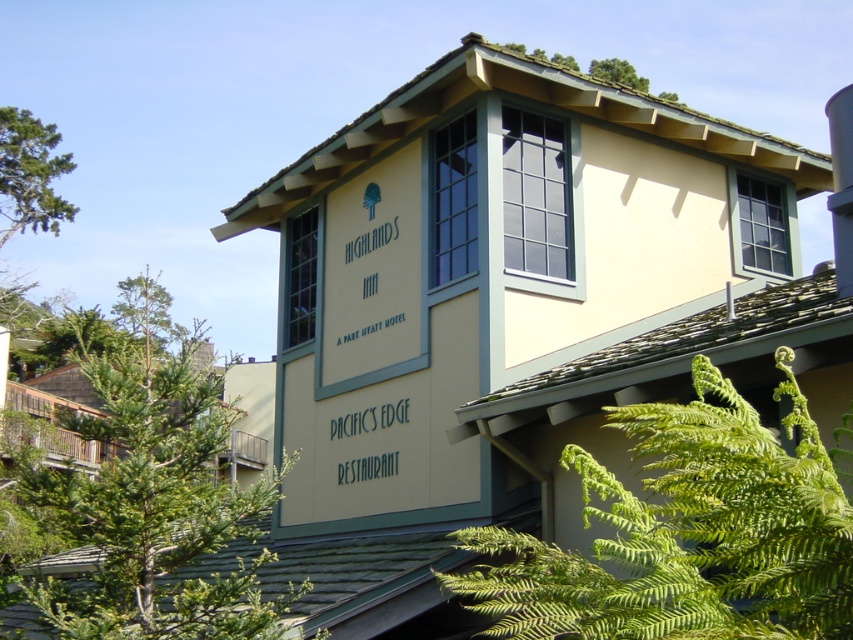
Looking at this image, you are standing in front of the Highlands Inn and want to place a decorative pot between the green leafy fern at lower right and the green leafy tree at upper center. Which object should you place the pot closer to if you want the pot to be closer to the narrower plant?

The green leafy fern at lower right has a lesser width compared to the green leafy tree at upper center, so you should place the pot closer to the green leafy fern at lower right to be nearer to the narrower plant.

You are standing at the entrance of the Highlands Inn and want to take a photo of the green leafy tree at center. Where should you position yourself to capture the tree in the frame?

The green leafy tree at center is located at point 0.772 on the x axis and 0.179 on the y axis, so you should position yourself in the lower right area to capture the tree in the frame.

In the scene shown: You are standing in front of the Highlands Inn building and want to locate the green leafy fern at lower right. Based on the 2D coordinates provided, which direction should you look to find it?

The green leafy fern at lower right is located at point 0.833 on the x axis and 0.805 on the y axis, so you should look to the lower right direction to find it.